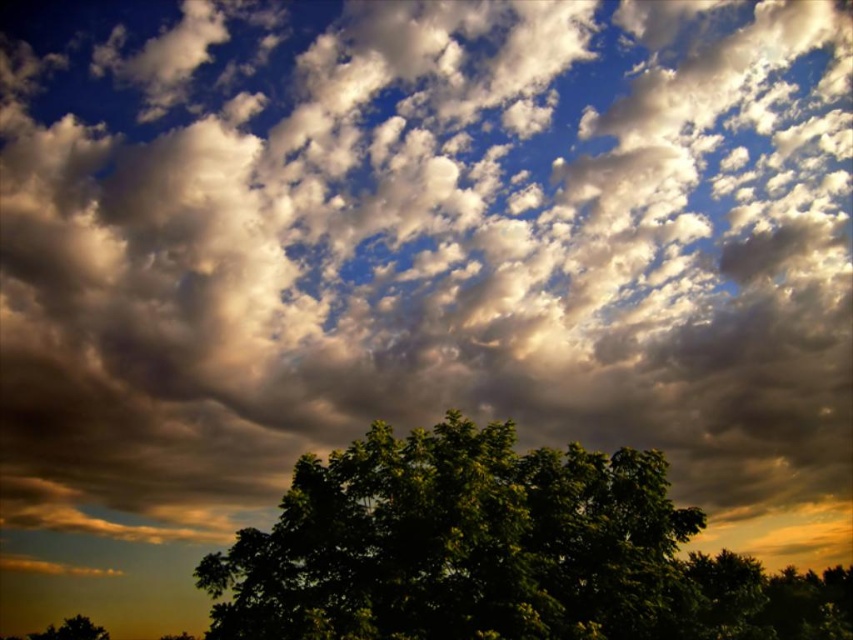
Does green leafy tree at center have a greater height compared to green leafy tree at lower center?

Indeed, green leafy tree at center has a greater height compared to green leafy tree at lower center.

Which is more to the right, green leafy tree at center or green leafy tree at lower center?

From the viewer's perspective, green leafy tree at center appears more on the right side.

Find the location of `green leafy tree at center`. green leafy tree at center is located at coordinates (498, 552).